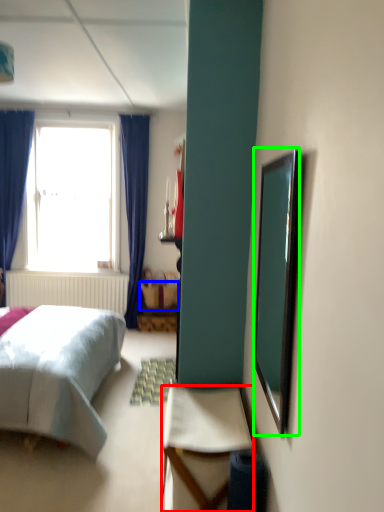
Question: Which is farther away from desk (highlighted by a red box)? picnic basket (highlighted by a blue box) or mirror (highlighted by a green box)?

Choices:
 (A) picnic basket
 (B) mirror

Answer: (A)